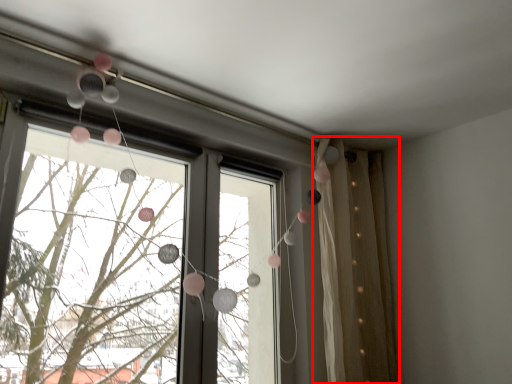
Question: From the image's perspective, what is the correct spatial positioning of curtain (annotated by the red box) in reference to window?

Choices:
 (A) below
 (B) above

Answer: (A)